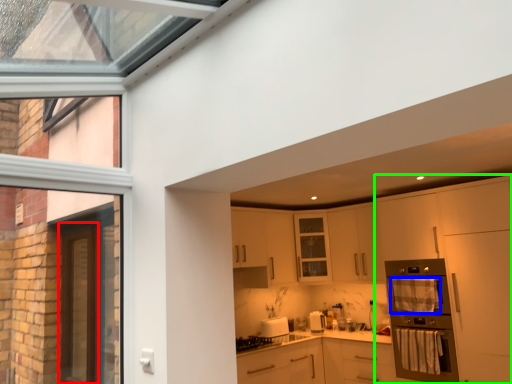
Question: Considering the real-world distances, which object is closest to screen door (highlighted by a red box)? material (highlighted by a blue box) or cabinetry (highlighted by a green box).

Choices:
 (A) material
 (B) cabinetry

Answer: (A)